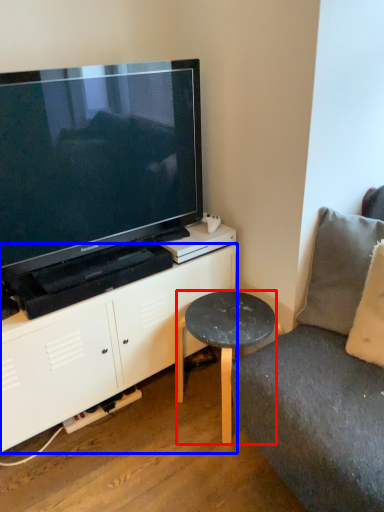
Question: Which object appears closest to the camera in this image, table (highlighted by a red box) or cabinetry (highlighted by a blue box)?

Choices:
 (A) table
 (B) cabinetry

Answer: (B)